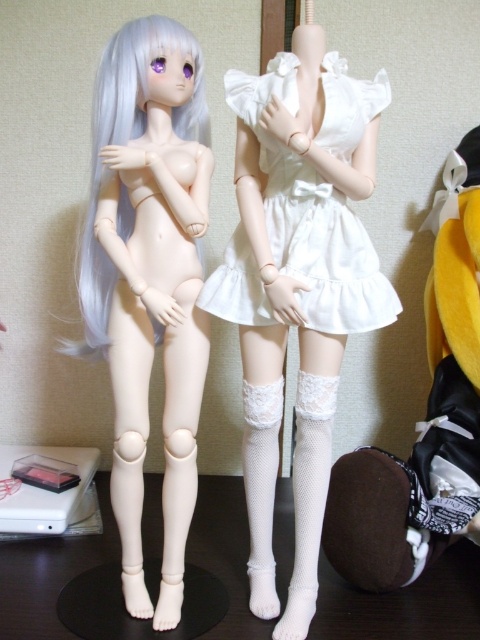
Who is lower down, white lace socks at lower right or white satin dress at center?

Positioned lower is white lace socks at lower right.

Who is more distant from viewer, (399, 529) or (254, 273)?

Point (399, 529)

The image size is (480, 640). What do you see at coordinates (424, 419) in the screenshot? I see `white lace socks at lower right` at bounding box center [424, 419].

This screenshot has height=640, width=480. In order to click on white lace socks at lower right in this screenshot , I will do `click(424, 419)`.

Is white matte dress at center above white lace socks at lower right?

Correct, white matte dress at center is located above white lace socks at lower right.

In order to click on white matte dress at center in this screenshot , I will do `click(298, 284)`.

This screenshot has width=480, height=640. What are the coordinates of `white matte dress at center` in the screenshot? It's located at (x=298, y=284).

How much distance is there between white lace socks at lower right and white matte wig at upper left?

21.44 inches

Is white lace socks at lower right thinner than white matte wig at upper left?

In fact, white lace socks at lower right might be wider than white matte wig at upper left.

Does point (458, 323) lie behind point (84, 291)?

Yes, it is behind point (84, 291).

This screenshot has width=480, height=640. In order to click on white lace socks at lower right in this screenshot , I will do click(424, 419).